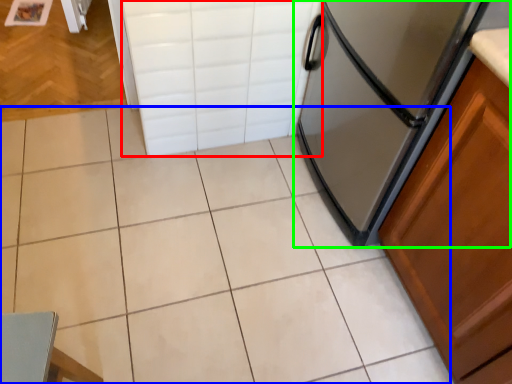
Question: Based on their relative distances, which object is nearer to drawer (highlighted by a red box)? Choose from ceramic tile (highlighted by a blue box) and refrigerator (highlighted by a green box).

Choices:
 (A) ceramic tile
 (B) refrigerator

Answer: (B)